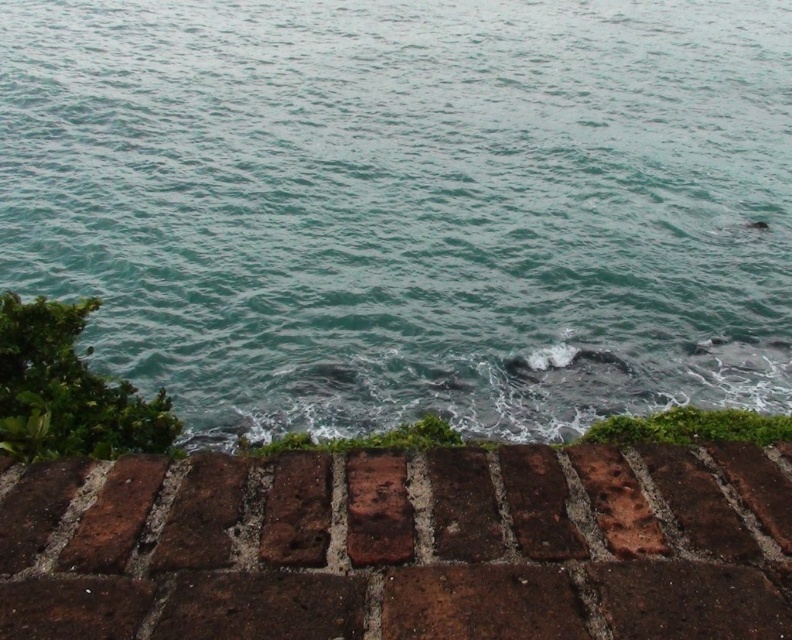
Question: Which of the following is the closest to the observer?

Choices:
 (A) brown brick wall at lower center
 (B) teal water at center

Answer: (A)

Question: Considering the relative positions of teal water at center and brown brick wall at lower center in the image provided, where is teal water at center located with respect to brown brick wall at lower center?

Choices:
 (A) above
 (B) below

Answer: (A)

Question: Which point is farther to the camera?

Choices:
 (A) (568, 488)
 (B) (429, 205)

Answer: (B)

Question: Which object is closer to the camera taking this photo?

Choices:
 (A) teal water at center
 (B) brown brick wall at lower center

Answer: (B)

Question: Is teal water at center below brown brick wall at lower center?

Choices:
 (A) yes
 (B) no

Answer: (B)

Question: Can you confirm if teal water at center is bigger than brown brick wall at lower center?

Choices:
 (A) yes
 (B) no

Answer: (A)